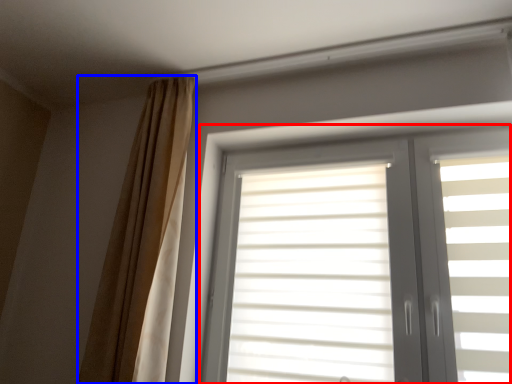
Question: Which object is further to the camera taking this photo, window (highlighted by a red box) or curtain (highlighted by a blue box)?

Choices:
 (A) window
 (B) curtain

Answer: (B)